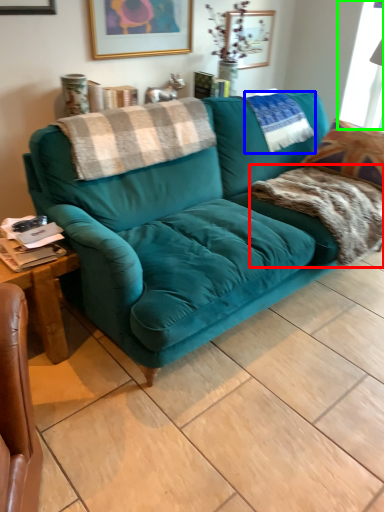
Question: Estimate the real-world distances between objects in this image. Which object is closer to blanket (highlighted by a red box), pillow (highlighted by a blue box) or window screen (highlighted by a green box)?

Choices:
 (A) pillow
 (B) window screen

Answer: (A)